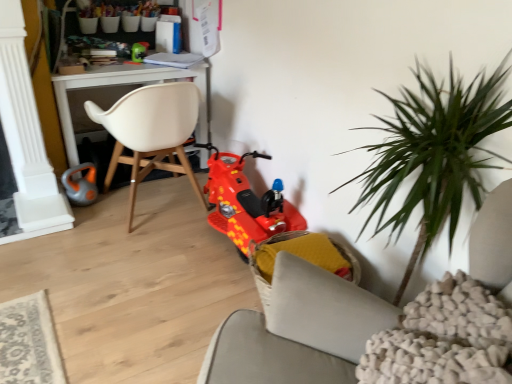
Locate an element on the screen. The width and height of the screenshot is (512, 384). vacant area to the right of orange rubber toy at lower left, which appears as the third toy when viewed from the right is located at coordinates (113, 205).